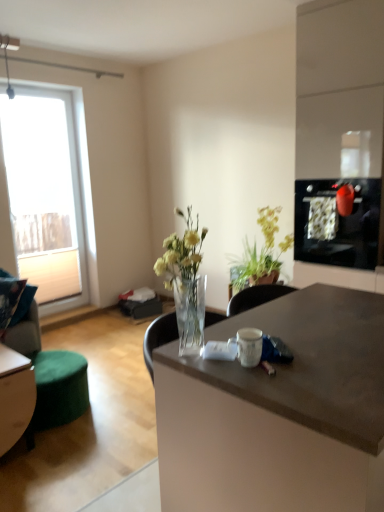
Question: From a real-world perspective, is black glass screen door at upper right positioned over matte brown desk at center based on gravity?

Choices:
 (A) no
 (B) yes

Answer: (B)

Question: Is black glass screen door at upper right bigger than matte brown desk at center?

Choices:
 (A) no
 (B) yes

Answer: (A)

Question: Is black glass screen door at upper right not inside matte brown desk at center?

Choices:
 (A) no
 (B) yes

Answer: (B)

Question: Is black glass screen door at upper right positioned far away from matte brown desk at center?

Choices:
 (A) no
 (B) yes

Answer: (B)

Question: Could you tell me if black glass screen door at upper right is turned towards matte brown desk at center?

Choices:
 (A) yes
 (B) no

Answer: (A)

Question: Is point pyautogui.click(x=246, y=279) closer or farther from the camera than point pyautogui.click(x=36, y=371)?

Choices:
 (A) farther
 (B) closer

Answer: (A)

Question: Considering the positions of green leafy plant at center and green fabric swivel chair at lower left in the image, is green leafy plant at center taller or shorter than green fabric swivel chair at lower left?

Choices:
 (A) short
 (B) tall

Answer: (B)

Question: From a real-world perspective, is green leafy plant at center above or below green fabric swivel chair at lower left?

Choices:
 (A) above
 (B) below

Answer: (A)

Question: Is green leafy plant at center bigger or smaller than green fabric swivel chair at lower left?

Choices:
 (A) big
 (B) small

Answer: (B)

Question: In terms of size, does black glass screen door at upper right appear bigger or smaller than green fabric ottoman at lower left?

Choices:
 (A) small
 (B) big

Answer: (B)

Question: Looking at their shapes, would you say black glass screen door at upper right is wider or thinner than green fabric ottoman at lower left?

Choices:
 (A) wide
 (B) thin

Answer: (B)

Question: Relative to green fabric ottoman at lower left, is black glass screen door at upper right in front or behind?

Choices:
 (A) behind
 (B) front

Answer: (A)

Question: Considering the positions of point (354, 197) and point (13, 381), is point (354, 197) closer or farther from the camera than point (13, 381)?

Choices:
 (A) farther
 (B) closer

Answer: (A)

Question: Based on their sizes in the image, would you say green leafy plant at center is bigger or smaller than green fabric ottoman at lower left?

Choices:
 (A) big
 (B) small

Answer: (B)

Question: Is green leafy plant at center inside or outside of green fabric ottoman at lower left?

Choices:
 (A) inside
 (B) outside

Answer: (B)